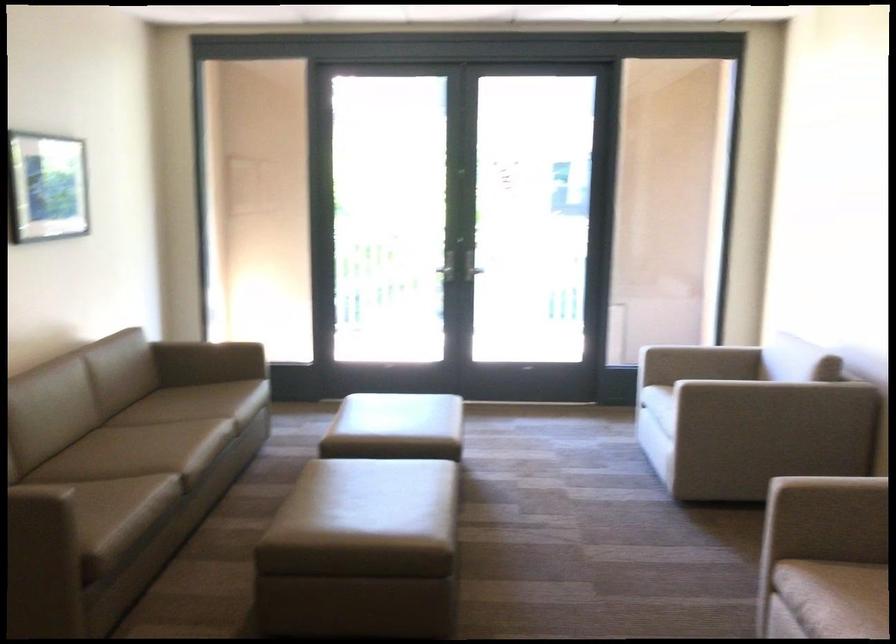
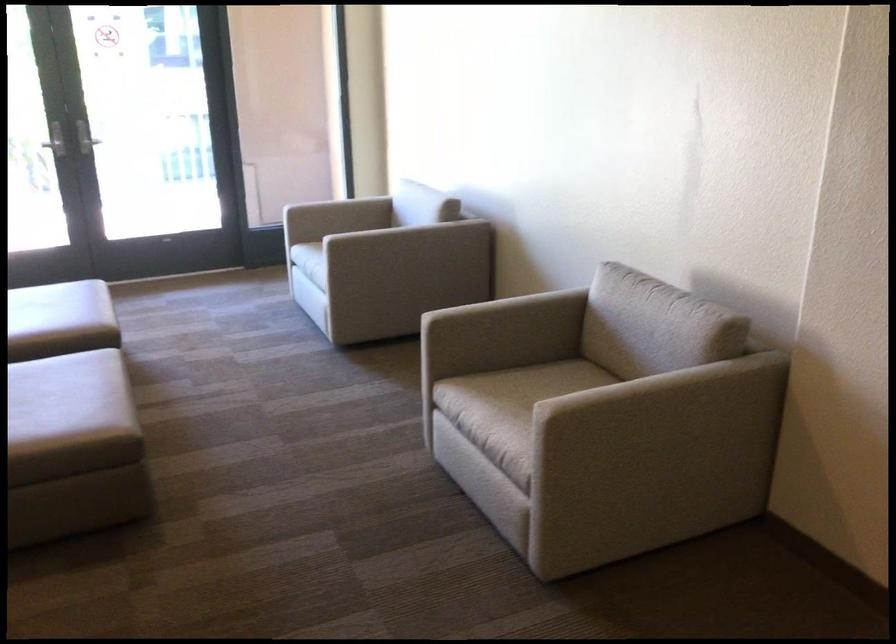
In the second image, find the point that corresponds to (785,406) in the first image.

(417, 242)